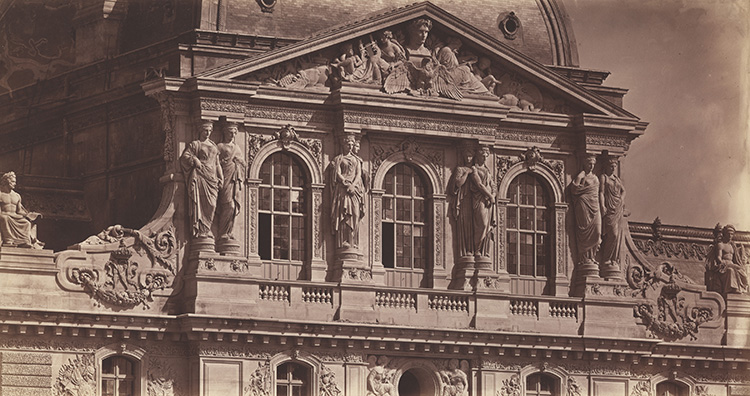
At what (x,y) coordinates should I click in order to perform the action: click on people in chairs. Please return your answer as a coordinate pair (x, y). The image size is (750, 396). Looking at the image, I should click on (723, 280), (14, 235).